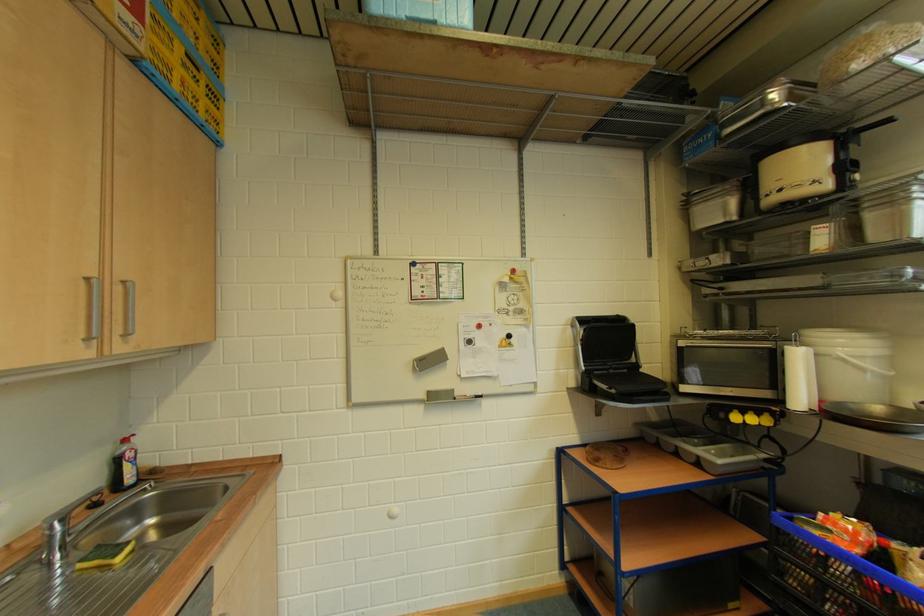
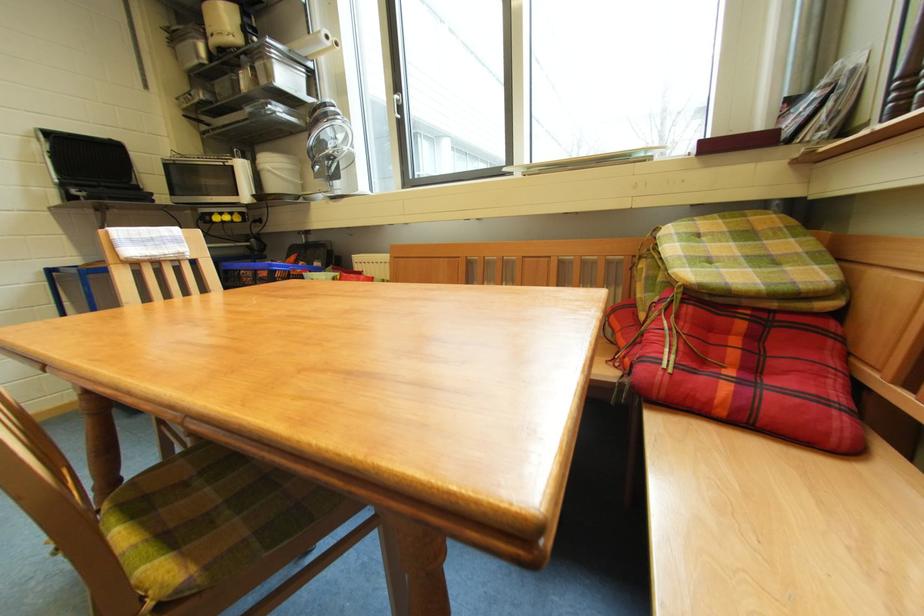
Where in the second image is the point corresponding to (x=617, y=392) from the first image?

(88, 193)